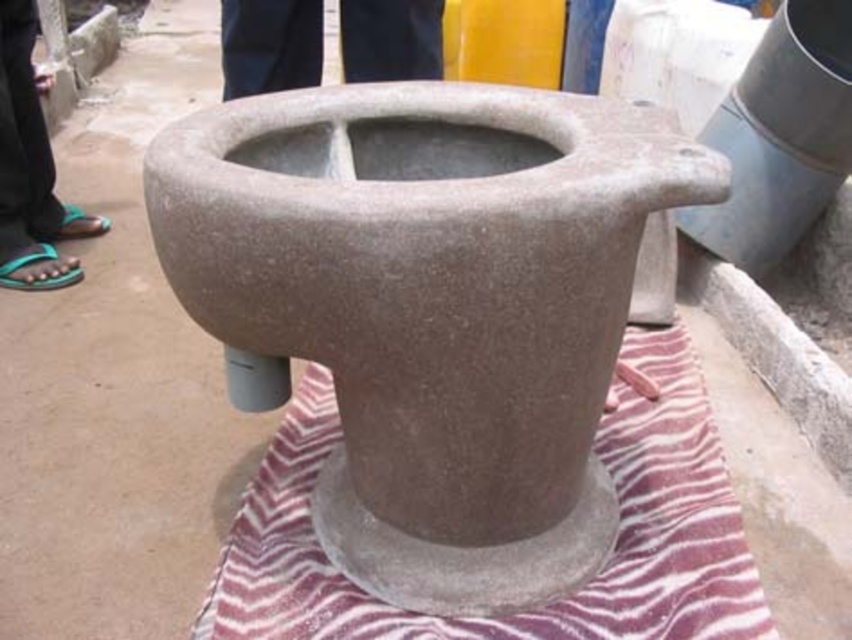
Question: Does striped fabric mat at center appear under dark blue pants at upper center?

Choices:
 (A) no
 (B) yes

Answer: (B)

Question: Which object is positioned closest to the green flip-flops at lower left?

Choices:
 (A) dark blue pants at upper center
 (B) striped fabric mat at center

Answer: (A)

Question: Which of the following is the farthest from the observer?

Choices:
 (A) (10, 192)
 (B) (407, 33)

Answer: (A)

Question: Which object is positioned closest to the dark blue pants at upper center?

Choices:
 (A) green flip-flops at lower left
 (B) striped fabric mat at center

Answer: (A)

Question: Does striped fabric mat at center have a greater width compared to green flip-flops at lower left?

Choices:
 (A) no
 (B) yes

Answer: (B)

Question: From the image, what is the correct spatial relationship of striped fabric mat at center in relation to green flip-flops at lower left?

Choices:
 (A) left
 (B) right

Answer: (B)